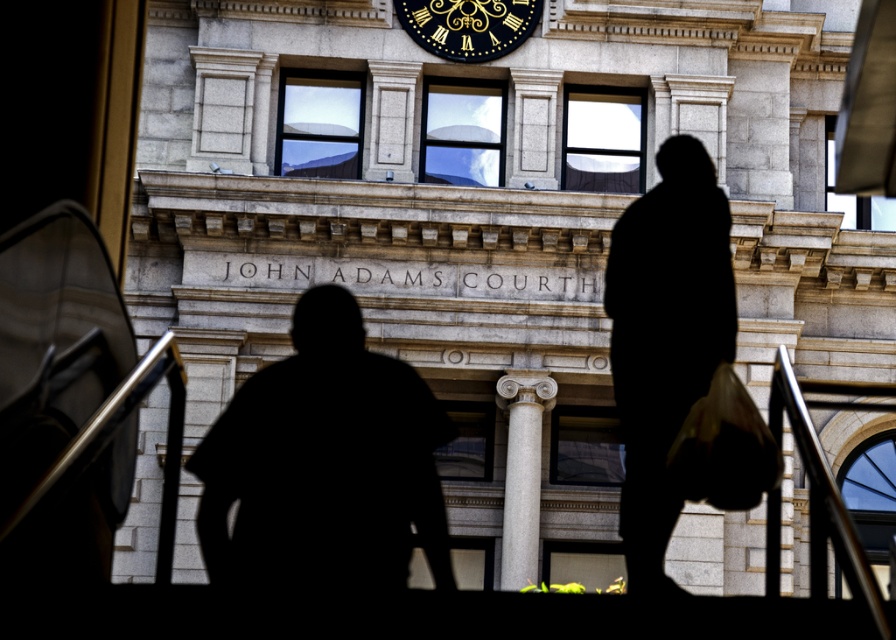
Which is more to the left, black fabric bag at center or gray stone column at center?

gray stone column at center

The width and height of the screenshot is (896, 640). Find the location of `black fabric bag at center`. black fabric bag at center is located at coordinates (665, 339).

Does black silhouette at center come in front of black-golden clock at upper center?

Yes, black silhouette at center is in front of black-golden clock at upper center.

Locate an element on the screen. black silhouette at center is located at coordinates (324, 467).

Which is more to the right, black silhouette at center or black fabric bag at center?

From the viewer's perspective, black fabric bag at center appears more on the right side.

Between point (355, 372) and point (679, 268), which one is positioned behind?

The point (355, 372) is behind.

Image resolution: width=896 pixels, height=640 pixels. I want to click on black silhouette at center, so click(x=324, y=467).